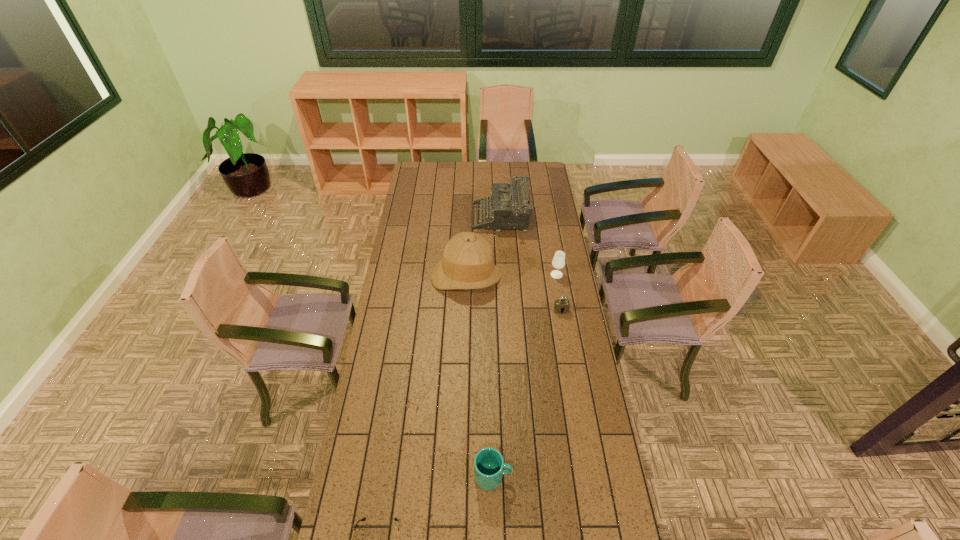
Find the location of a particular element. Image resolution: width=960 pixels, height=540 pixels. hat is located at coordinates (467, 263).

You are a GUI agent. You are given a task and a screenshot of the screen. Output one action in this format:
    pyautogui.click(x=<x>, y=<y>)
    Task: Click on the fifth shortest object
    
    Given the screenshot: What is the action you would take?
    pyautogui.click(x=509, y=207)

This screenshot has height=540, width=960. In order to click on typewriter in this screenshot , I will do `click(509, 207)`.

In order to click on glass in this screenshot , I will do `click(558, 262)`.

Where is `the fifth farthest object`? The height and width of the screenshot is (540, 960). the fifth farthest object is located at coordinates (488, 463).

Find the location of `cup`. cup is located at coordinates (488, 463).

The width and height of the screenshot is (960, 540). I want to click on the second shortest object, so click(562, 305).

The width and height of the screenshot is (960, 540). In order to click on the fourth farthest object in this screenshot , I will do `click(562, 305)`.

Locate an element on the screen. vacant area situated on the front-facing side of the tallest object is located at coordinates (464, 333).

Image resolution: width=960 pixels, height=540 pixels. Find the location of `blank area located 0.110m on the typing side of the second tallest object`. blank area located 0.110m on the typing side of the second tallest object is located at coordinates (453, 219).